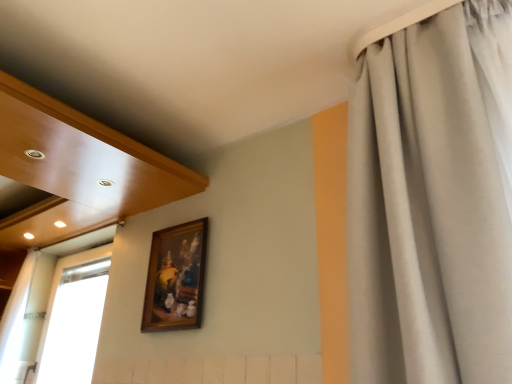
Question: Is satin gray curtain at right, the 2th curtain positioned from the back, closer to camera compared to white sheer curtain at left, the 1th curtain viewed from the back?

Choices:
 (A) no
 (B) yes

Answer: (B)

Question: Does satin gray curtain at right, which appears as the 1th curtain when viewed from the right, turn towards white sheer curtain at left, the second curtain positioned from the right?

Choices:
 (A) no
 (B) yes

Answer: (A)

Question: Is satin gray curtain at right, which ranks as the 2th curtain in bottom-to-top order, surrounding white sheer curtain at left, which is the second curtain in front-to-back order?

Choices:
 (A) yes
 (B) no

Answer: (B)

Question: Is satin gray curtain at right, which appears as the 1th curtain when viewed from the right, positioned behind white sheer curtain at left, which is the 1th curtain from left to right?

Choices:
 (A) no
 (B) yes

Answer: (A)

Question: Does satin gray curtain at right, the first curtain positioned from the front, have a smaller size compared to white sheer curtain at left, acting as the second curtain starting from the top?

Choices:
 (A) no
 (B) yes

Answer: (A)

Question: Is wooden frame at upper center to the left or to the right of satin gray curtain at right, which appears as the 1th curtain when viewed from the right, in the image?

Choices:
 (A) left
 (B) right

Answer: (A)

Question: From the image's perspective, is wooden frame at upper center above or below satin gray curtain at right, the 2th curtain positioned from the back?

Choices:
 (A) below
 (B) above

Answer: (A)

Question: Considering the positions of wooden frame at upper center and satin gray curtain at right, which appears as the 1th curtain when viewed from the right, in the image, is wooden frame at upper center bigger or smaller than satin gray curtain at right, which appears as the 1th curtain when viewed from the right,?

Choices:
 (A) big
 (B) small

Answer: (B)

Question: Is wooden frame at upper center in front of or behind satin gray curtain at right, the 2th curtain positioned from the back, in the image?

Choices:
 (A) behind
 (B) front

Answer: (A)

Question: In the image, is wooden frame at upper center positioned in front of or behind white sheer curtain at left, acting as the second curtain starting from the top?

Choices:
 (A) front
 (B) behind

Answer: (A)

Question: Visually, is wooden frame at upper center positioned to the left or to the right of white sheer curtain at left, the 1th curtain positioned from the bottom?

Choices:
 (A) left
 (B) right

Answer: (B)

Question: Is wooden frame at upper center situated inside white sheer curtain at left, the 1th curtain viewed from the back, or outside?

Choices:
 (A) outside
 (B) inside

Answer: (A)

Question: Considering the positions of wooden frame at upper center and white sheer curtain at left, acting as the second curtain starting from the top, in the image, is wooden frame at upper center taller or shorter than white sheer curtain at left, acting as the second curtain starting from the top,?

Choices:
 (A) tall
 (B) short

Answer: (B)

Question: Would you say wooden frame at upper center is to the left or to the right of white sheer curtain at left in the picture?

Choices:
 (A) left
 (B) right

Answer: (B)

Question: Looking at their shapes, would you say wooden frame at upper center is wider or thinner than white sheer curtain at left?

Choices:
 (A) thin
 (B) wide

Answer: (A)